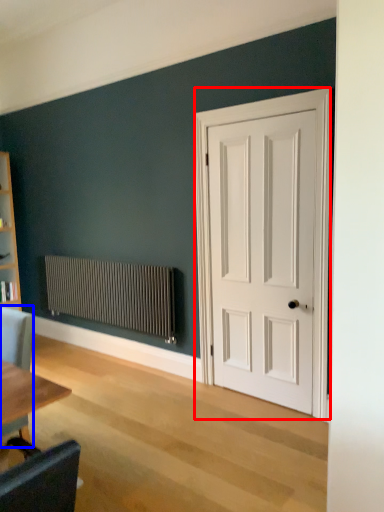
Question: Which object is further to the camera taking this photo, door (highlighted by a red box) or chair (highlighted by a blue box)?

Choices:
 (A) door
 (B) chair

Answer: (A)